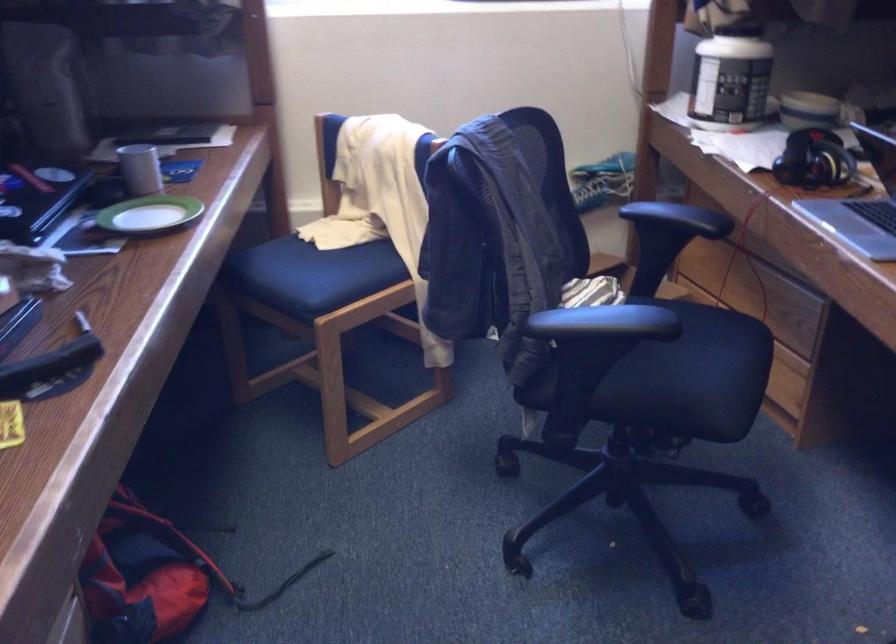
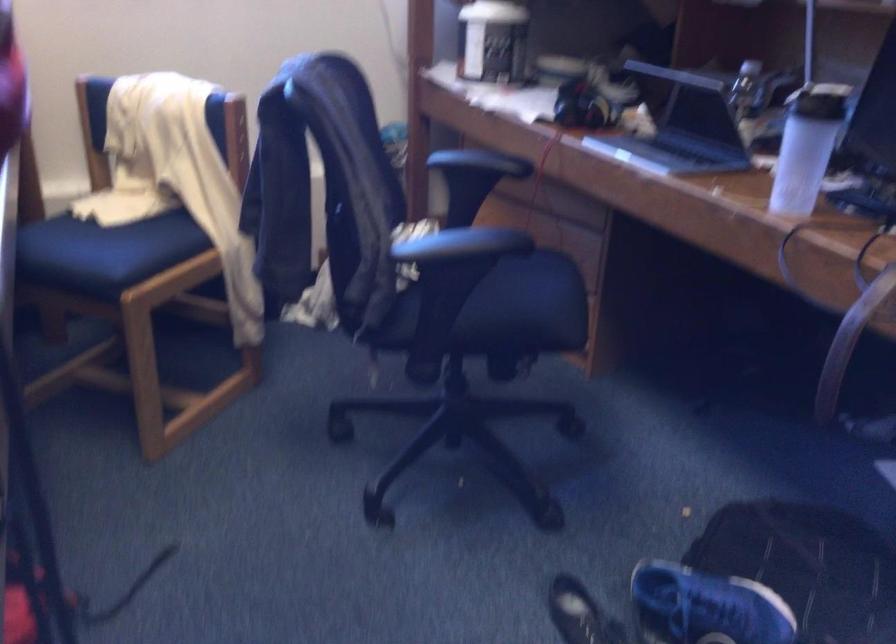
The point at [607,317] is marked in the first image. Where is the corresponding point in the second image?

(471, 242)